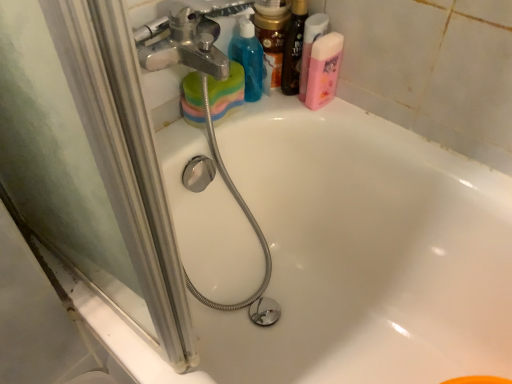
I want to click on free space on the front side of pink matte bottle at upper right, which appears as the second cleaning product when viewed from the left, so click(345, 128).